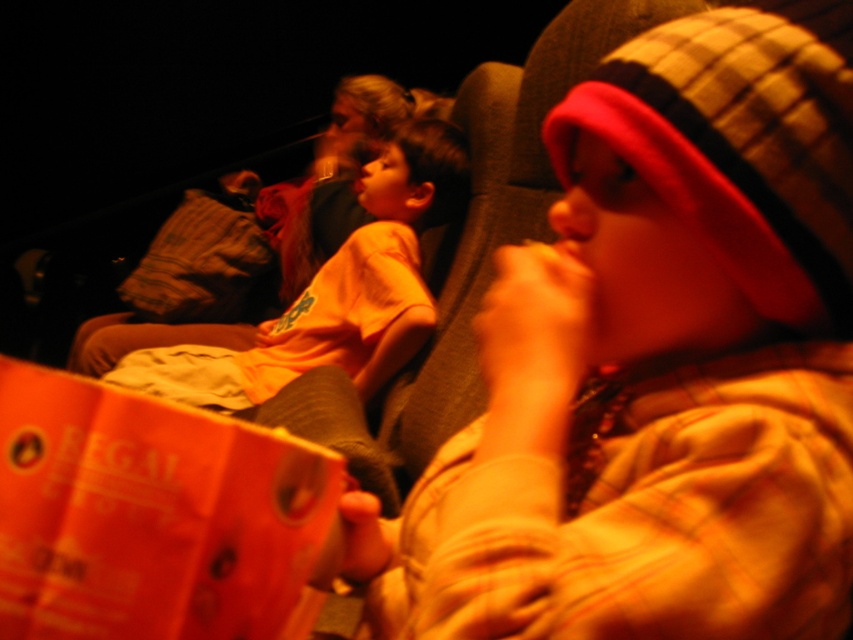
Based on the scene description, where exactly is the matte orange shirt at center located in the image?

The matte orange shirt at center is located at point coordinates of 0.567 on the x axis and 0.777 on the y axis.

In the movie theater scene, there are two orange shirts at the center. Which one is shorter in height between the matte orange shirt at center and the orange cotton shirt at center?

The matte orange shirt at center is shorter in height compared to the orange cotton shirt at center.

You are sitting in the movie theater and want to hand a snack to the person wearing the matte orange shirt at center and the orange cotton shirt at center. Which one can you reach without moving from your seat?

The matte orange shirt at center is closer to the viewer than the orange cotton shirt at center, so you can reach the matte orange shirt at center without moving from your seat.